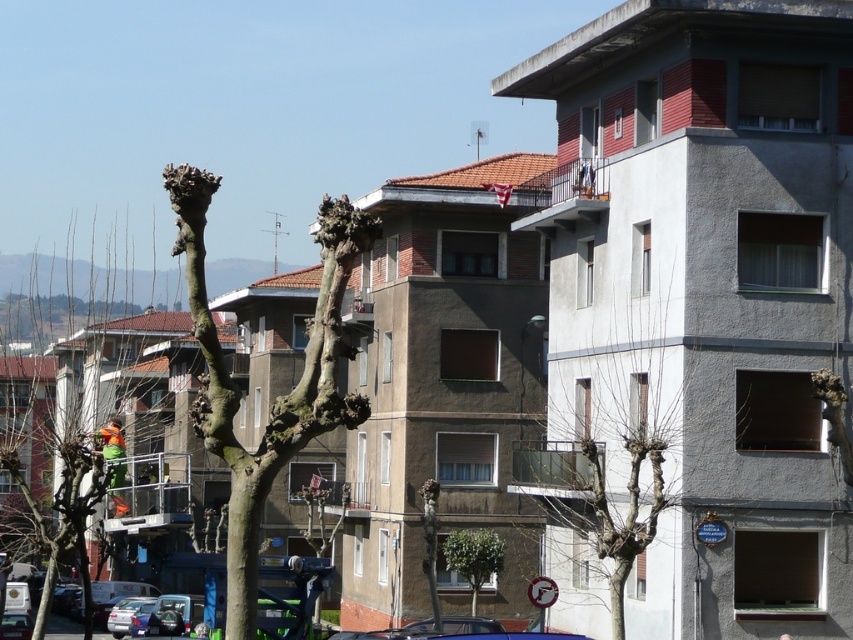
You are standing in an urban residential area and want to take a photo of the bare branches at left. If you are 50 meters away from them, will you need to zoom in your camera to capture them clearly?

The bare branches at left are 51.23 meters away from the viewer. Since you are 50 meters away, you are closer than the actual distance, so you can capture them without zooming in.

You are standing in the urban residential area depicted in the image. There is a point marked at coordinates point (50, 460). What object in the scene corresponds to this point?

The point (50, 460) corresponds to the bare branches at left.

You are a pedestrian standing in the urban residential area shown. You notice the bare branches at left and the green reflective safety vest at center. Which object would block your view more if you were to stand directly in front of them?

The bare branches at left would block your view more because they are bigger than the green reflective safety vest at center.